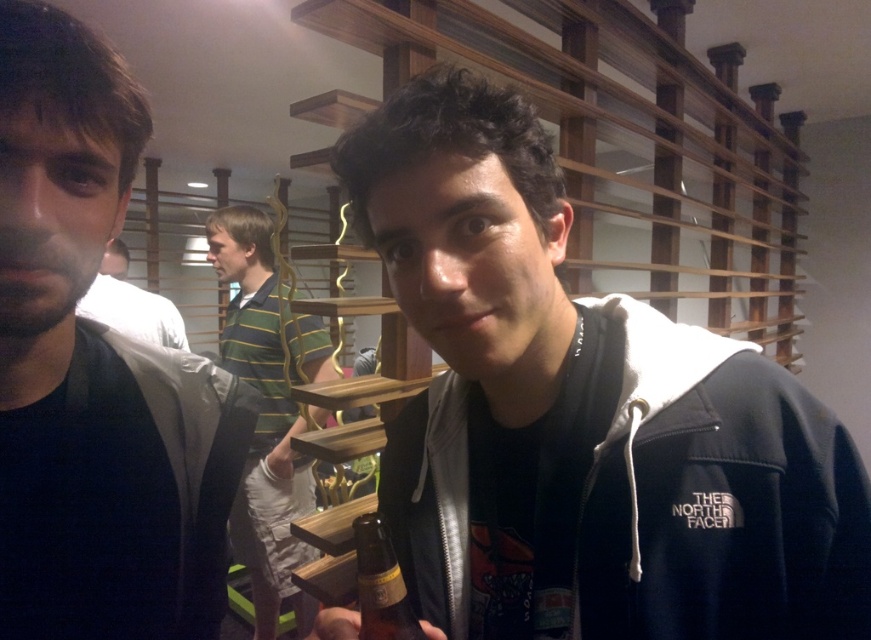
You are standing in the bar and want to place a small plant between the two points, point (360, 196) and point (245, 321). Which point should the plant be closer to if you want it to appear larger in the photo?

The plant should be placed closer to point (360, 196) because it is closer to the viewer, making the plant appear larger in the photo.

You are a photographer trying to capture a group photo of the dark brown hair at left and the white matte shirt at center. Given that your camera has a depth of field that can focus on objects within 5 feet, will both subjects be in focus?

The distance between the dark brown hair at left and the white matte shirt at center is 5.87 feet, which exceeds the camera sensor depth of field of 5 feet. Therefore, both subjects cannot be in focus simultaneously.